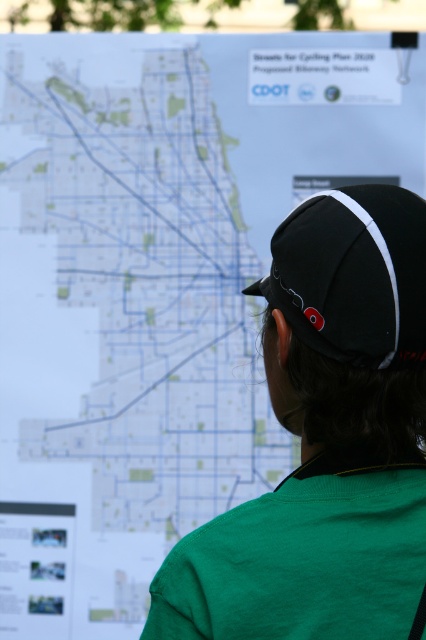
You are a tailor measuring a customer for a new outfit. You notice the green fabric shirt at center and the black fabric baseball cap at center. Which item is wider in terms of its width?

The green fabric shirt at center is wider than the black fabric baseball cap at center according to the description.

You are a cyclist planning a route and see the map displayed on the board. There is a point marked at coordinates (325, 442). What is located at that point on the map?

The point at coordinates (325, 442) indicates the green fabric shirt at center, which is part of the person observing the map.

You are a fashion designer analyzing the image. You need to determine which item of clothing is taller between the green fabric shirt at center and the black fabric baseball cap at center. Which one is taller?

The green fabric shirt at center is much taller than the black fabric baseball cap at center.